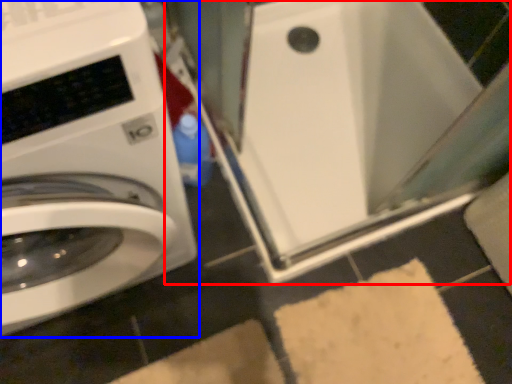
Question: Which object appears closest to the camera in this image, water heater (highlighted by a red box) or washing machine (highlighted by a blue box)?

Choices:
 (A) water heater
 (B) washing machine

Answer: (B)